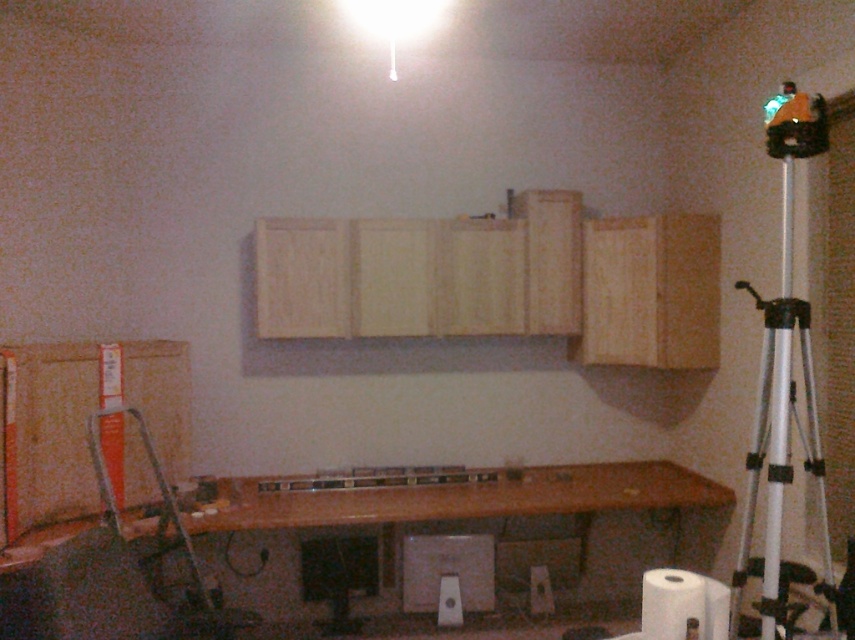
Question: Considering the real-world distances, which object is closest to the wooden at lower center?

Choices:
 (A) silver metallic tripod at right
 (B) white plastic speaker at center

Answer: (B)

Question: Does wooden at lower center come behind white plastic speaker at center?

Choices:
 (A) no
 (B) yes

Answer: (A)

Question: Which object is the closest to the wooden at lower center?

Choices:
 (A) silver metallic tripod at right
 (B) white plastic speaker at center

Answer: (B)

Question: Is wooden at lower center closer to the viewer compared to silver metallic tripod at right?

Choices:
 (A) yes
 (B) no

Answer: (B)

Question: Does wooden at lower center appear on the left side of white plastic speaker at center?

Choices:
 (A) no
 (B) yes

Answer: (B)

Question: Which object is farther from the camera taking this photo?

Choices:
 (A) wooden at lower center
 (B) silver metallic tripod at right

Answer: (A)